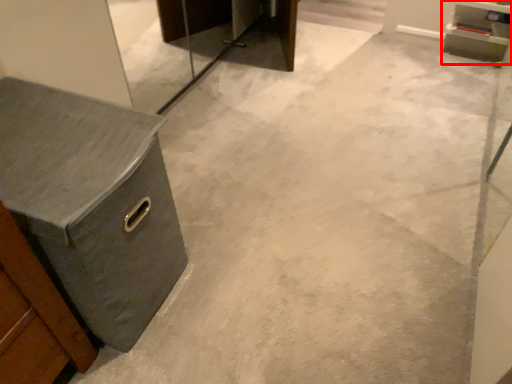
Question: From the image's perspective, considering the relative positions of cabinetry (annotated by the red box) and chest of drawers in the image provided, where is cabinetry (annotated by the red box) located with respect to the staircase?

Choices:
 (A) above
 (B) below

Answer: (A)